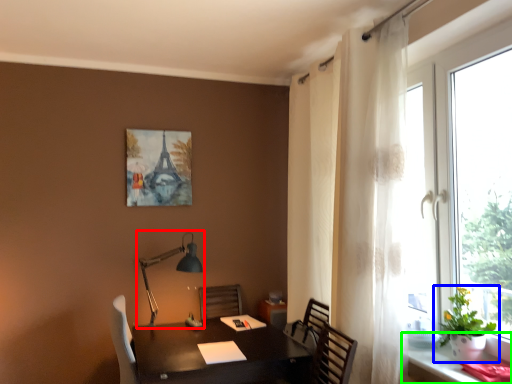
Question: Considering the real-world distances, which object is farthest from table lamp (highlighted by a red box)? houseplant (highlighted by a blue box) or computer desk (highlighted by a green box)?

Choices:
 (A) houseplant
 (B) computer desk

Answer: (A)